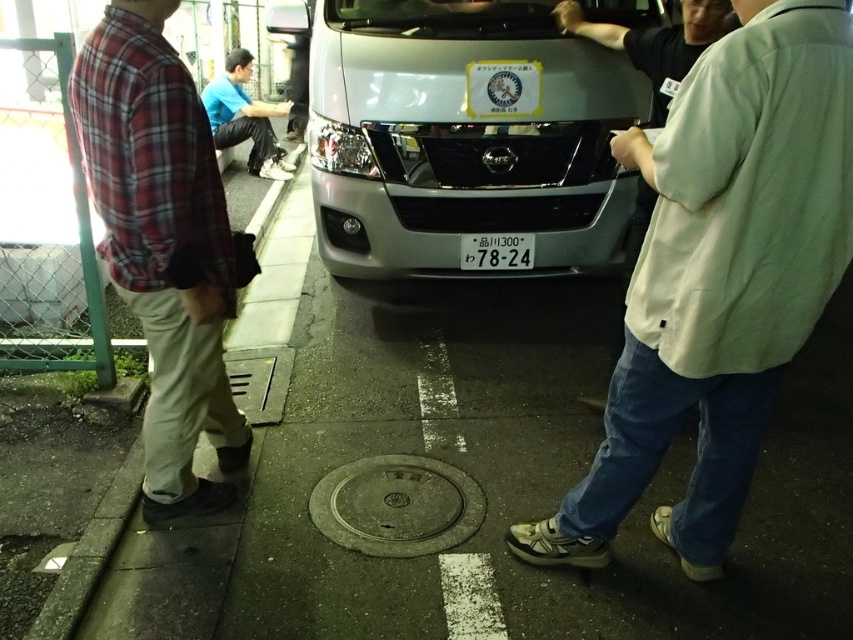
You are a pedestrian standing on the sidewalk and see the plaid fabric shirt at left and the gray metallic manhole cover at center. Which object is closer to you?

The plaid fabric shirt at left is closer to you because it is in front of the gray metallic manhole cover at center.

You are a delivery driver who needs to park your vehicle in this area. The parking spot here can only accommodate vehicles smaller than the gray metallic manhole cover at center. Can your satin silver van at center fit in the spot?

The satin silver van at center is larger in size than the gray metallic manhole cover at center, so it cannot fit in the parking spot designated for smaller vehicles.

You are a delivery person with a cart that is 1.5 meters wide. You need to navigate between the satin silver van at center and the gray metallic manhole cover at center to reach the delivery point. Can your cart fit through the space between them?

The distance between the satin silver van at center and the gray metallic manhole cover at center is 1.35 meters. Since the cart is 1.5 meters wide, it cannot fit through the space between them as the available space is narrower than the cart.